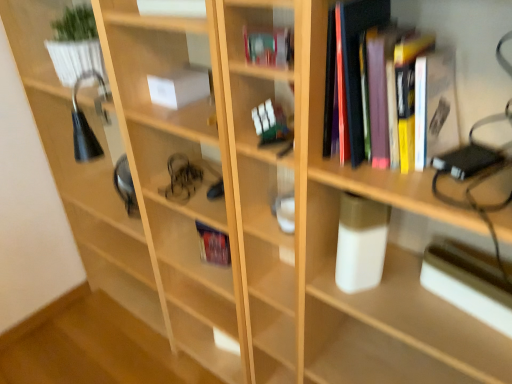
Question: Considering the positions of point (19, 4) and point (202, 246), is point (19, 4) closer or farther from the camera than point (202, 246)?

Choices:
 (A) farther
 (B) closer

Answer: (A)

Question: Is white glossy plant pot at upper left, acting as the 2th shelf starting from the front, inside the boundaries of hardcover book at center, the 5th book in the front-to-back sequence, or outside?

Choices:
 (A) inside
 (B) outside

Answer: (B)

Question: Which of these objects is positioned closest to the white glossy book at upper center, the third book from the front?

Choices:
 (A) hardcover book at upper center, the 2th book positioned from the front
 (B) hardcover books at upper right, the first book viewed from the front
 (C) metallic silver paperback book at right
 (D) hardcover book at center, the first book when ordered from back to front
 (E) white glossy glass at center, acting as the 1th shelf starting from the bottom

Answer: (A)

Question: Estimate the real-world distances between objects in this image. Which object is farther from the white glossy plant pot at upper left, which is counted as the first shelf, starting from the left?

Choices:
 (A) white glossy book at upper center, the third book from the front
 (B) metallic silver paperback book at right
 (C) white paper at center, acting as the 2th book starting from the back
 (D) hardcover book at center, the first book when ordered from back to front
 (E) hardcover book at upper center, acting as the 4th book starting from the back

Answer: (B)